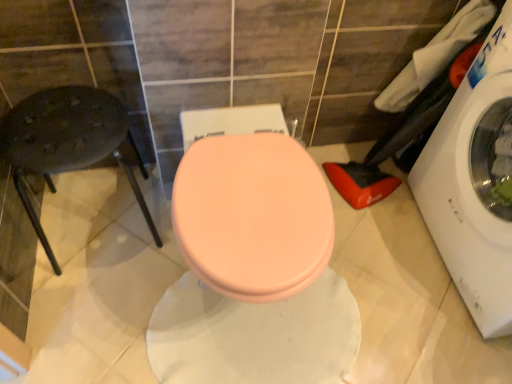
Question: Based on their sizes in the image, would you say metallic black stool at left is bigger or smaller than white fabric at upper right, placed as the 1th laundry when sorted from left to right?

Choices:
 (A) small
 (B) big

Answer: (B)

Question: Is metallic black stool at left inside the boundaries of white fabric at upper right, placed as the 1th laundry when sorted from left to right, or outside?

Choices:
 (A) outside
 (B) inside

Answer: (A)

Question: Which is farther from the white glossy washing machine at right?

Choices:
 (A) matte pink toilet seat at center
 (B) white fabric at upper right, acting as the second laundry starting from the right
 (C) white fabric laundry at right, the 2th laundry from the left
 (D) metallic black stool at left

Answer: (D)

Question: Which object is positioned closest to the white fabric at upper right, acting as the second laundry starting from the right?

Choices:
 (A) white glossy washing machine at right
 (B) metallic black stool at left
 (C) white fabric laundry at right, the 2th laundry from the left
 (D) matte pink toilet seat at center

Answer: (C)